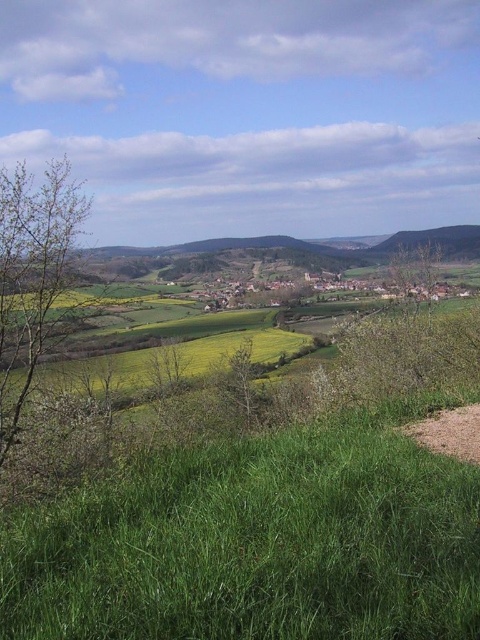
Question: Among these points, which one is farthest from the camera?

Choices:
 (A) (469, 429)
 (B) (216, 608)

Answer: (A)

Question: Which object is farther from the camera taking this photo?

Choices:
 (A) brown dirt trail at lower right
 (B) green grassy at lower right

Answer: (A)

Question: Is green grassy at lower right wider than brown dirt trail at lower right?

Choices:
 (A) yes
 (B) no

Answer: (A)

Question: Is green grassy at lower right smaller than brown dirt trail at lower right?

Choices:
 (A) yes
 (B) no

Answer: (B)

Question: Can you confirm if green grassy at lower right is positioned to the right of brown dirt trail at lower right?

Choices:
 (A) yes
 (B) no

Answer: (B)